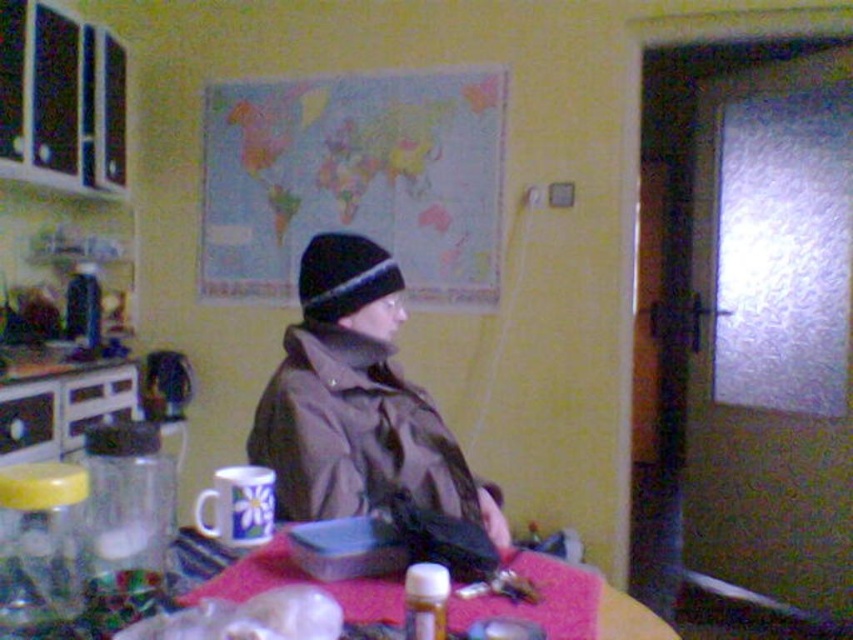
Question: Can you confirm if brown matte jacket at center is positioned below black knit hat at center?

Choices:
 (A) yes
 (B) no

Answer: (A)

Question: Observing the image, what is the correct spatial positioning of brown matte jacket at center in reference to black knit hat at center?

Choices:
 (A) left
 (B) right

Answer: (B)

Question: In this image, where is brown matte jacket at center located relative to black knit hat at center?

Choices:
 (A) above
 (B) below

Answer: (B)